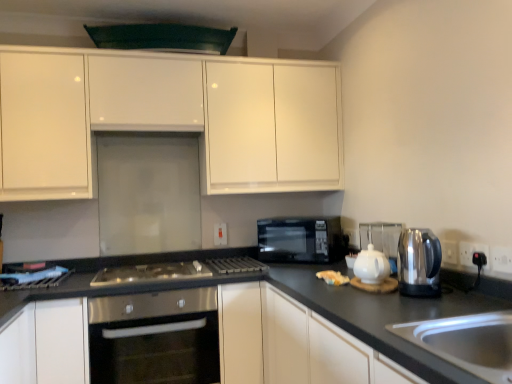
Find the location of a particular element. This screenshot has width=512, height=384. free point to the right of stainless steel kettle at right is located at coordinates (464, 301).